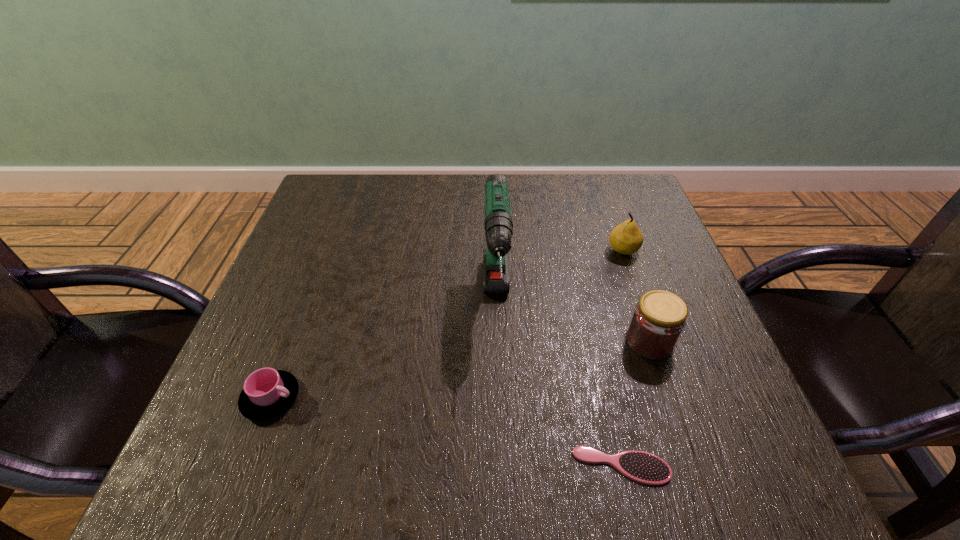
In the image, there is a desktop. Identify the location of free space at the near edge. This screenshot has width=960, height=540. (422, 465).

Identify the location of vacant region at the left edge of the desktop. (243, 363).

Locate an element on the screen. vacant space at the right edge is located at coordinates (701, 399).

Locate an element on the screen. The image size is (960, 540). vacant position at the far left corner of the desktop is located at coordinates click(347, 184).

In the image, there is a desktop. In order to click on vacant area at the far right corner in this screenshot , I will do `click(631, 183)`.

You are a GUI agent. You are given a task and a screenshot of the screen. Output one action in this format:
    pyautogui.click(x=<x>, y=<y>)
    Task: Click on the vacant space at the near right corner of the desktop
    
    Given the screenshot: What is the action you would take?
    pyautogui.click(x=700, y=447)

Find the location of a particular element. The image size is (960, 540). free space between the tallest object and the pear is located at coordinates (560, 276).

Locate an element on the screen. empty space that is in between the jam and the leftmost object is located at coordinates (460, 369).

Locate an element on the screen. free space between the tallest object and the pear is located at coordinates (560, 276).

Identify the location of free space that is in between the pear and the cup. This screenshot has height=540, width=960. (447, 324).